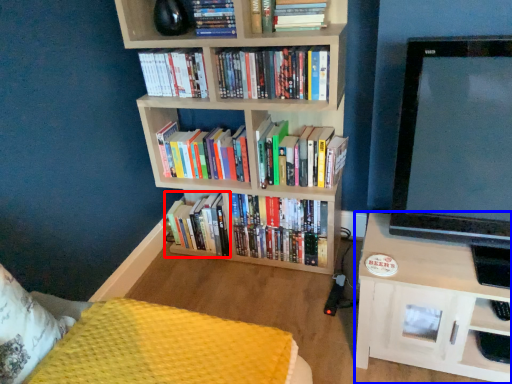
Question: Which point is further to the camera, book (highlighted by a red box) or shelf (highlighted by a blue box)?

Choices:
 (A) book
 (B) shelf

Answer: (A)